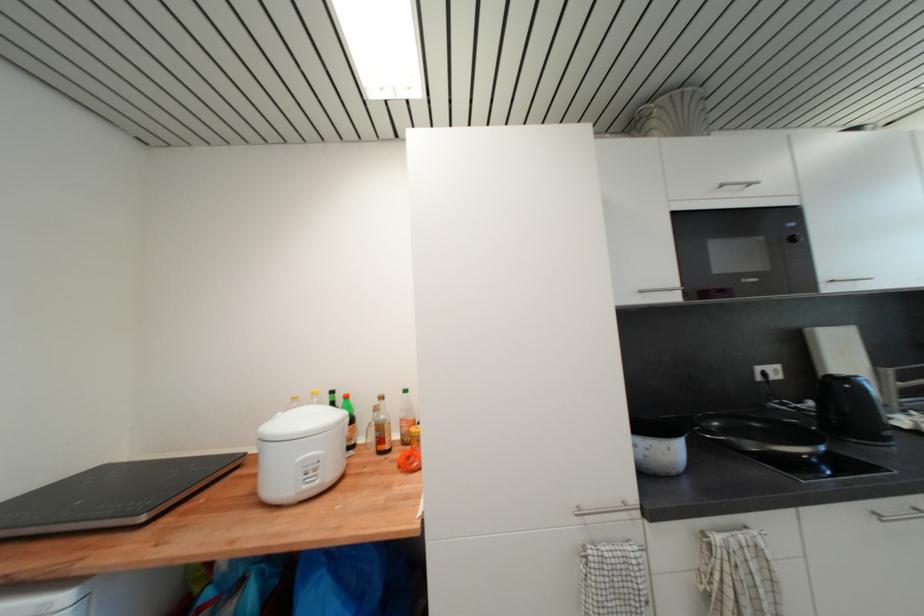
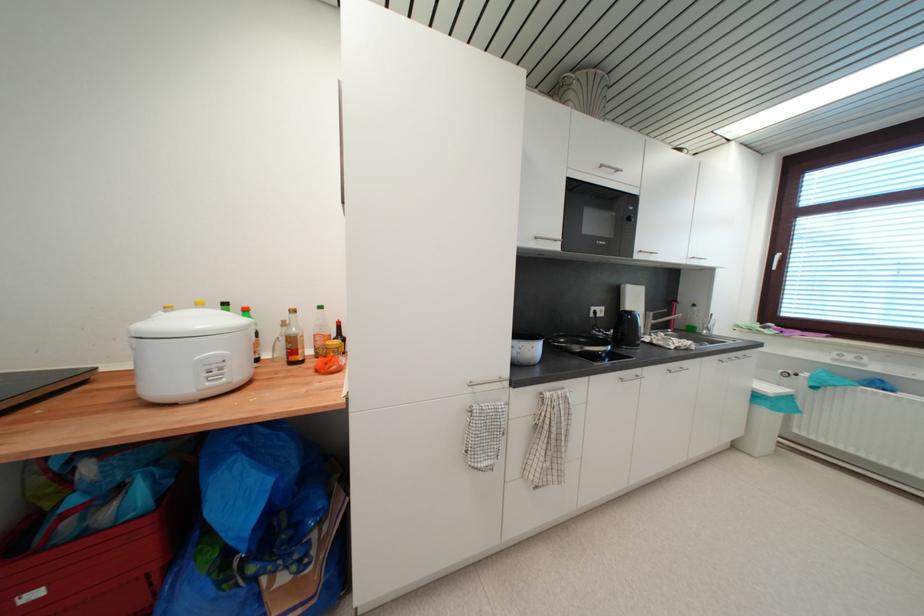
Question: I am providing you with two images of the same scene from different viewpoints. Please identify which objects are invisible in image2.

Choices:
 (A) silver cabinet handle
 (B) brown glass bottle
 (C) woven basket
 (D) none of these

Answer: (D)